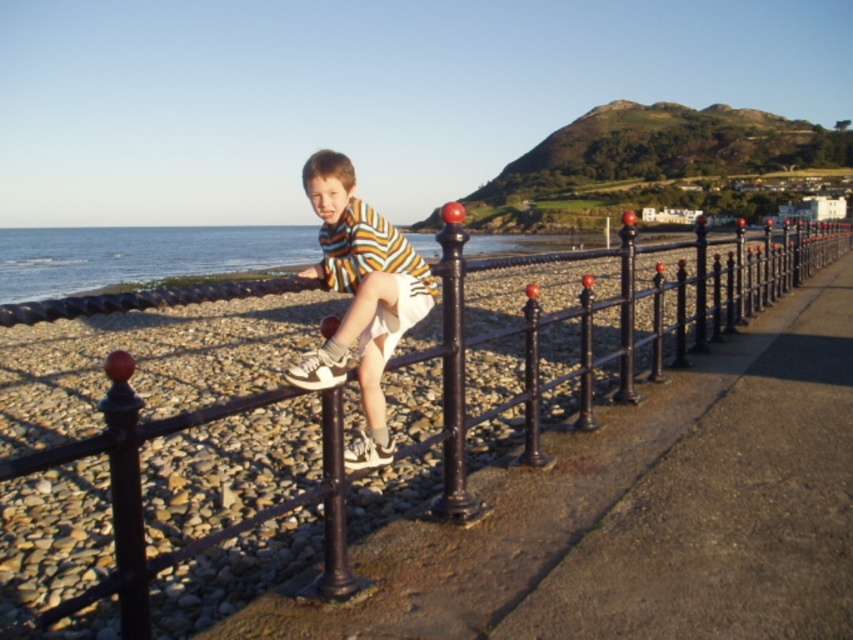
Question: Among these points, which one is nearest to the camera?

Choices:
 (A) (698, 237)
 (B) (297, 362)

Answer: (B)

Question: Can you confirm if black wrought iron fence at center is positioned to the left of striped cotton shirt at center?

Choices:
 (A) no
 (B) yes

Answer: (A)

Question: Which object is the closest to the glossy black pole at center?

Choices:
 (A) black wrought iron fence at center
 (B) striped cotton shirt at center

Answer: (A)

Question: Does striped cotton shirt at center have a smaller size compared to glossy black pole at center?

Choices:
 (A) no
 (B) yes

Answer: (B)

Question: Can you confirm if black wrought iron fence at center is wider than glossy black pole at center?

Choices:
 (A) no
 (B) yes

Answer: (B)

Question: Which of the following is the farthest from the observer?

Choices:
 (A) (131, 432)
 (B) (344, 211)

Answer: (B)